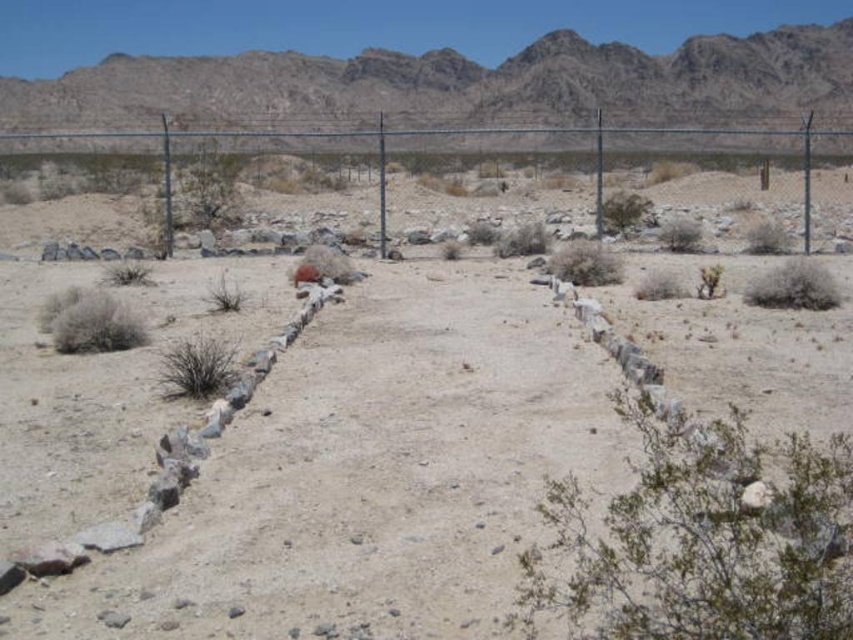
You are a GUI agent. You are given a task and a screenshot of the screen. Output one action in this format:
    pyautogui.click(x=<x>, y=<y>)
    Task: Click on the dull gray dirt field at center
    
    Given the screenshot: What is the action you would take?
    pyautogui.click(x=367, y=474)

Describe the element at coordinates (367, 474) in the screenshot. The image size is (853, 640). I see `dull gray dirt field at center` at that location.

Between point (252, 458) and point (424, 132), which one is positioned behind?

The point (424, 132) is more distant.

This screenshot has width=853, height=640. I want to click on dull gray dirt field at center, so click(367, 474).

Where is `rugged rock mountain at upper center`? This screenshot has width=853, height=640. rugged rock mountain at upper center is located at coordinates (457, 86).

Does point (242, 93) come farther from viewer compared to point (822, 131)?

Yes, point (242, 93) is behind point (822, 131).

Between point (645, 74) and point (550, 132), which one is positioned in front?

Positioned in front is point (550, 132).

Find the location of a particular element. This screenshot has width=853, height=640. rugged rock mountain at upper center is located at coordinates click(x=457, y=86).

From the picture: Does dull gray dirt field at center appear over rugged rock mountain at upper center?

Incorrect, dull gray dirt field at center is not positioned above rugged rock mountain at upper center.

Can you confirm if dull gray dirt field at center is bigger than rugged rock mountain at upper center?

No, dull gray dirt field at center is not bigger than rugged rock mountain at upper center.

Find the location of a particular element. This screenshot has height=640, width=853. dull gray dirt field at center is located at coordinates (367, 474).

Locate an element on the screen. The image size is (853, 640). dull gray dirt field at center is located at coordinates (367, 474).